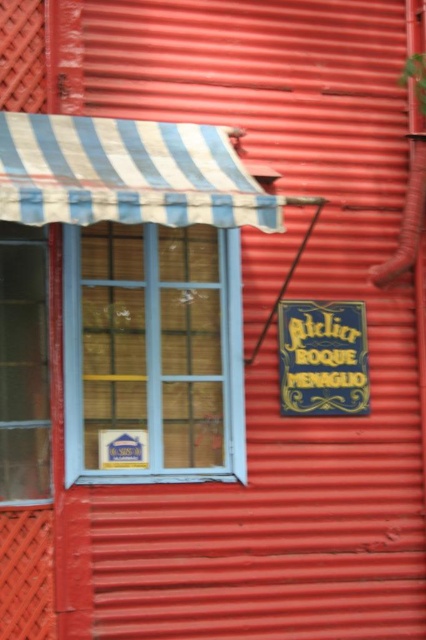
Question: Can you confirm if clear glass window at left is thinner than blue painted wood sign at center right?

Choices:
 (A) no
 (B) yes

Answer: (B)

Question: Can you confirm if clear glass window at left is positioned below blue painted wood sign at center right?

Choices:
 (A) no
 (B) yes

Answer: (B)

Question: Based on their relative distances, which object is nearer to the clear glass window at left?

Choices:
 (A) blue painted wood sign at center right
 (B) blue painted wood window at center

Answer: (B)

Question: Is clear glass window at left closer to the viewer compared to blue painted wood sign at center right?

Choices:
 (A) yes
 (B) no

Answer: (A)

Question: Which point appears farthest from the camera in this image?

Choices:
 (A) (92, 310)
 (B) (342, 364)

Answer: (B)

Question: Which point is farther to the camera?

Choices:
 (A) blue painted wood window at center
 (B) clear glass window at left
 (C) blue painted wood sign at center right

Answer: (C)